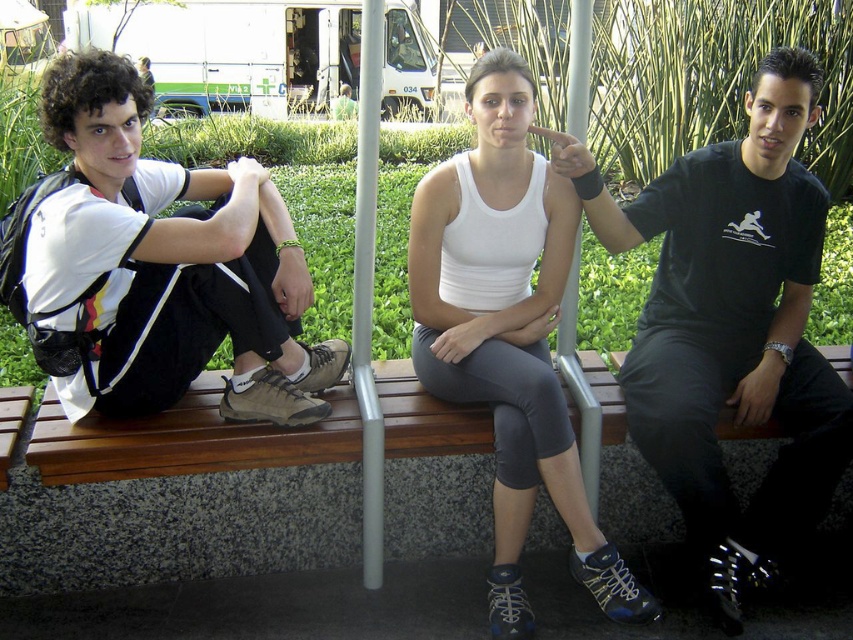
Can you confirm if black matte shirt at center is thinner than brown wooden bench at center?

Correct, black matte shirt at center's width is less than brown wooden bench at center's.

Who is more forward, (718, 253) or (277, 451)?

Point (277, 451) is in front.

Who is more forward, [664,326] or [71,438]?

Point [71,438] is more forward.

You are a GUI agent. You are given a task and a screenshot of the screen. Output one action in this format:
    pyautogui.click(x=<x>, y=<y>)
    Task: Click on the black matte shirt at center
    
    Given the screenshot: What is the action you would take?
    pyautogui.click(x=730, y=326)

From the picture: Is white matte t-shirt at left to the right of brown wooden bench at center from the viewer's perspective?

Incorrect, white matte t-shirt at left is not on the right side of brown wooden bench at center.

Consider the image. Does white matte t-shirt at left appear on the left side of brown wooden bench at center?

Indeed, white matte t-shirt at left is positioned on the left side of brown wooden bench at center.

Between point (41, 202) and point (183, 406), which one is positioned in front?

Positioned in front is point (41, 202).

In order to click on white matte t-shirt at left in this screenshot , I will do `click(155, 266)`.

Is white matte tank top at center wider than brown wooden bench at center?

In fact, white matte tank top at center might be narrower than brown wooden bench at center.

Is point (483, 401) positioned after point (728, 428)?

No, (483, 401) is in front of (728, 428).

Find the location of a particular element. white matte tank top at center is located at coordinates (508, 332).

The height and width of the screenshot is (640, 853). I want to click on white matte tank top at center, so click(508, 332).